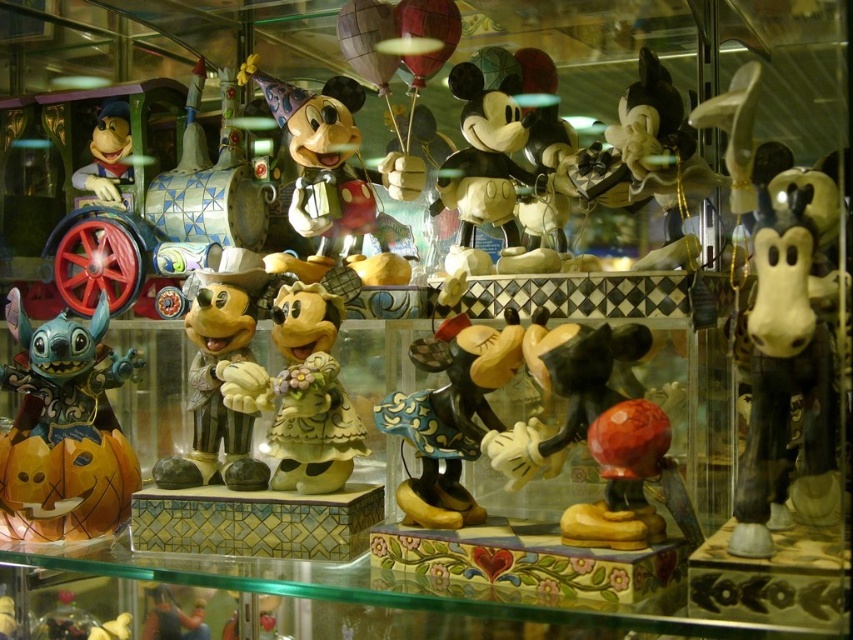
Which is below, matte orange pumpkin at left or matte ceramic mickey mouse at center?

matte orange pumpkin at left is below.

Is matte orange pumpkin at left below matte ceramic mickey mouse at center?

Yes, matte orange pumpkin at left is below matte ceramic mickey mouse at center.

Who is more forward, (28, 532) or (221, 316)?

Answer: Positioned in front is point (221, 316).

Where is `matte orange pumpkin at left`? Image resolution: width=853 pixels, height=640 pixels. matte orange pumpkin at left is located at coordinates (64, 432).

Which is above, matte orange pumpkin at left or matte yellow mickey mouse at center?

matte yellow mickey mouse at center

Where is `matte orange pumpkin at left`? Image resolution: width=853 pixels, height=640 pixels. matte orange pumpkin at left is located at coordinates [64, 432].

The image size is (853, 640). What are the coordinates of `matte orange pumpkin at left` in the screenshot? It's located at (64, 432).

Looking at this image, does porcelain minnie mouse at center have a greater width compared to matte yellow figure at left?

Yes.

Looking at this image, is the position of porcelain minnie mouse at center more distant than that of matte yellow figure at left?

No.

Does point (334, 300) come closer to viewer compared to point (113, 161)?

Yes, point (334, 300) is in front of point (113, 161).

Find the location of a particular element. This screenshot has width=853, height=640. porcelain minnie mouse at center is located at coordinates (310, 396).